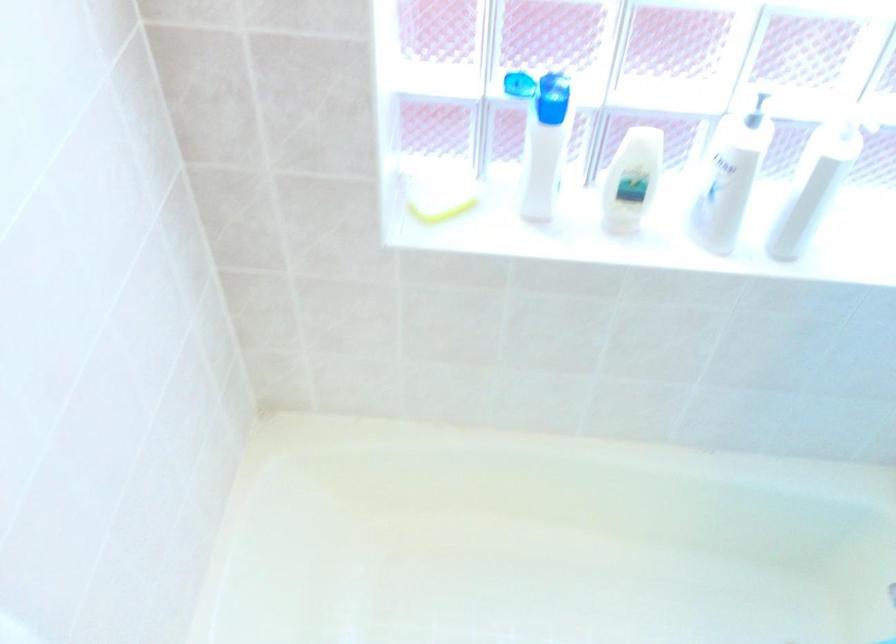
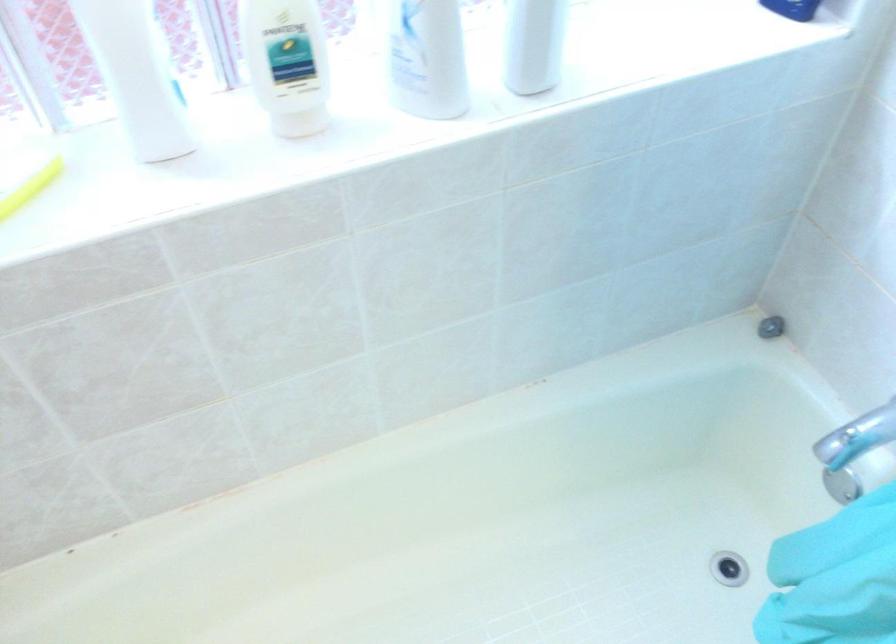
Question: Which direction would the cameraman need to move to produce the second image? Reply with the corresponding letter.

Choices:
 (A) Left
 (B) Right
 (C) Forward
 (D) Backward

Answer: (C)